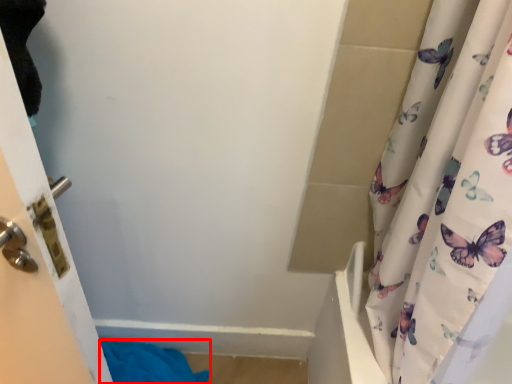
Question: From the image's perspective, where is bath towel (annotated by the red box) located relative to door?

Choices:
 (A) below
 (B) above

Answer: (A)